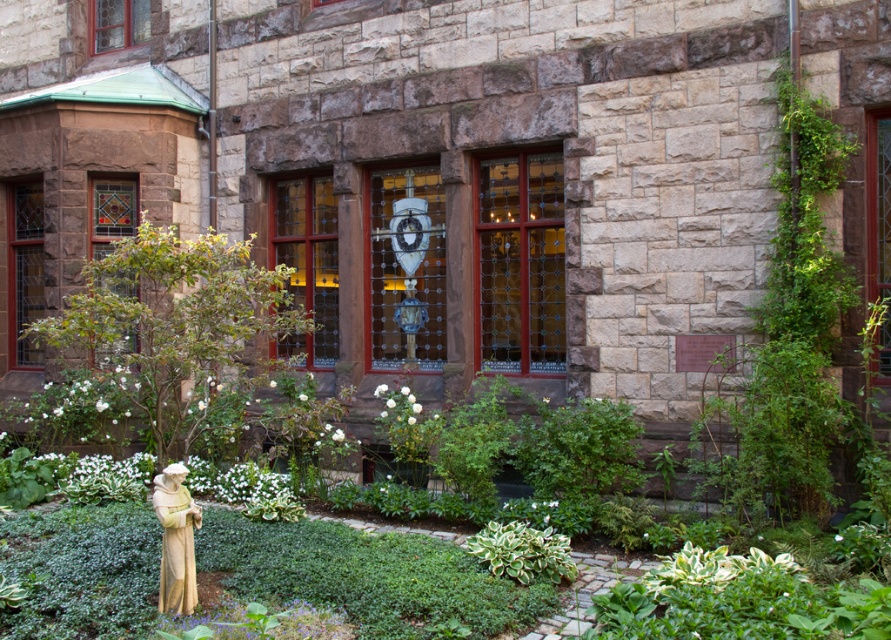
Question: Which object appears closest to the camera in this image?

Choices:
 (A) stone statue at lower left
 (B) variegated leafy plant at center
 (C) green leafy bush at lower left

Answer: (A)

Question: Considering the relative positions of green leafy bush at lower left and stone statue at lower left in the image provided, where is green leafy bush at lower left located with respect to stone statue at lower left?

Choices:
 (A) below
 (B) above

Answer: (B)

Question: Is green leafy bush at lower left positioned in front of variegated leafy plant at center?

Choices:
 (A) yes
 (B) no

Answer: (B)

Question: Which point is farther to the camera?

Choices:
 (A) (184, 493)
 (B) (195, 369)
 (C) (476, 548)

Answer: (B)

Question: Which point is closer to the camera?

Choices:
 (A) green leafy bush at lower left
 (B) stone statue at lower left
 (C) variegated leafy plant at center

Answer: (B)

Question: Does green leafy bush at lower left appear under variegated leafy plant at center?

Choices:
 (A) no
 (B) yes

Answer: (A)